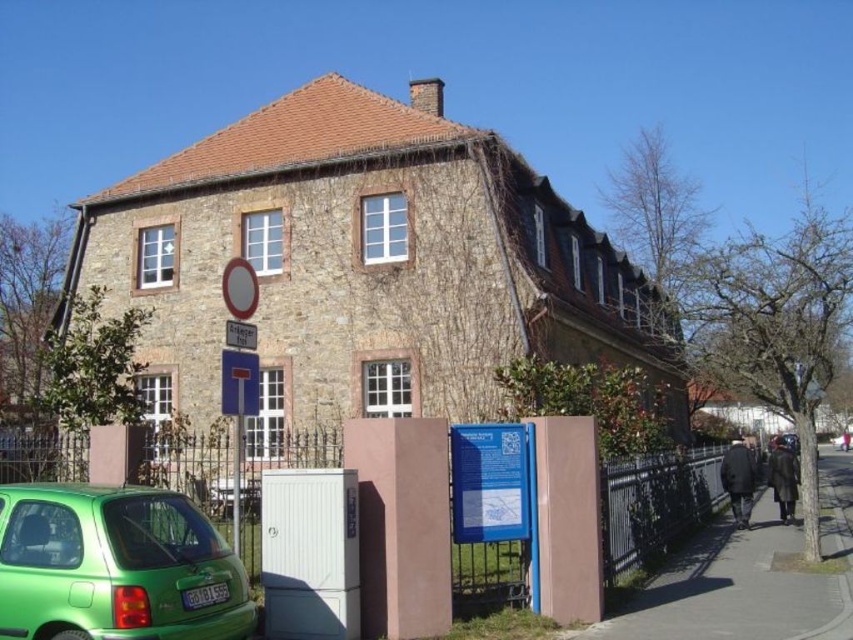
Is green matte hatchback at lower left wider than metallic silver fence at lower center?

In fact, green matte hatchback at lower left might be narrower than metallic silver fence at lower center.

Is the position of green matte hatchback at lower left more distant than that of metallic silver fence at lower center?

No, it is in front of metallic silver fence at lower center.

Which is behind, point (47, 536) or point (663, 552)?

Positioned behind is point (663, 552).

The image size is (853, 640). Find the location of `green matte hatchback at lower left`. green matte hatchback at lower left is located at coordinates (115, 566).